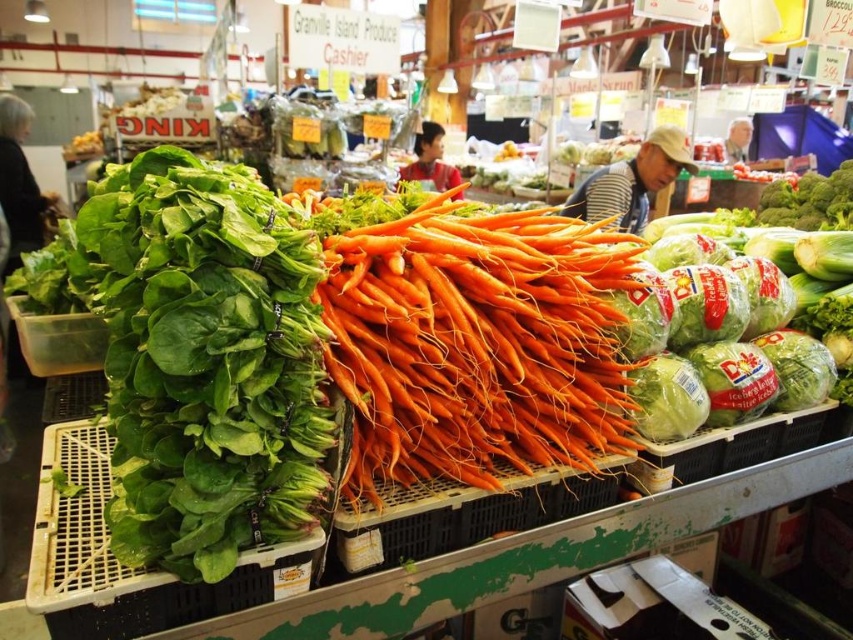
Question: Among these points, which one is nearest to the camera?

Choices:
 (A) (665, 435)
 (B) (292, 276)

Answer: (B)

Question: Which point is farther to the camera?

Choices:
 (A) (158, 506)
 (B) (683, 392)
 (C) (821, 388)

Answer: (C)

Question: Can you confirm if green leafy at left is thinner than green leafy material/texture at position?

Choices:
 (A) no
 (B) yes

Answer: (A)

Question: Among these objects, which one is farthest from the camera?

Choices:
 (A) green leafy at center
 (B) green leafy at left
 (C) orange smooth carrots at center
 (D) green leafy material/texture at position

Answer: (D)

Question: Can you confirm if green leafy at left is bigger than green leafy material/texture at position?

Choices:
 (A) no
 (B) yes

Answer: (B)

Question: Is green leafy at left positioned before green plastic bagged cabbage at center-right?

Choices:
 (A) yes
 (B) no

Answer: (A)